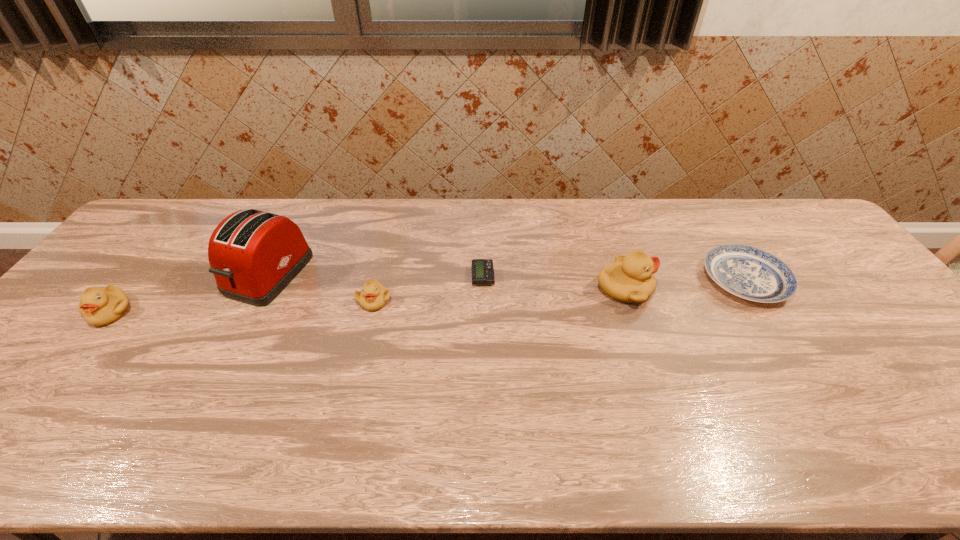
This screenshot has height=540, width=960. In order to click on the leftmost object in this screenshot , I will do `click(99, 307)`.

The height and width of the screenshot is (540, 960). I want to click on the second shortest duckling, so click(x=99, y=307).

Where is `the third object from left to right`? the third object from left to right is located at coordinates (373, 296).

Where is `the shortest duckling`? Image resolution: width=960 pixels, height=540 pixels. the shortest duckling is located at coordinates (373, 296).

Where is `the fifth object from left to right`? Image resolution: width=960 pixels, height=540 pixels. the fifth object from left to right is located at coordinates (630, 279).

Find the location of a particular element. The width and height of the screenshot is (960, 540). the rightmost duckling is located at coordinates (630, 279).

Where is `beeper`? The width and height of the screenshot is (960, 540). beeper is located at coordinates (482, 269).

Identify the location of the fourth object from left to right. Image resolution: width=960 pixels, height=540 pixels. (482, 269).

Where is `the tallest object`? the tallest object is located at coordinates (254, 255).

Identify the location of toaster. This screenshot has width=960, height=540. (254, 255).